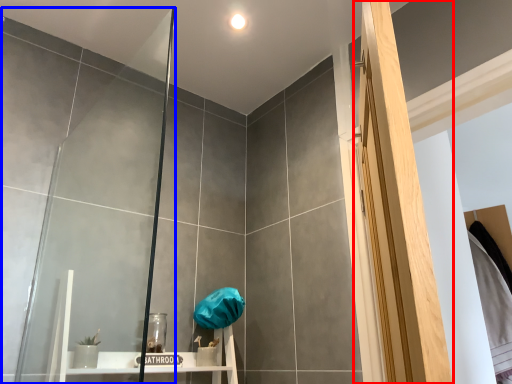
Question: Which point is closer to the camera, screen door (highlighted by a red box) or glass door (highlighted by a blue box)?

Choices:
 (A) screen door
 (B) glass door

Answer: (A)